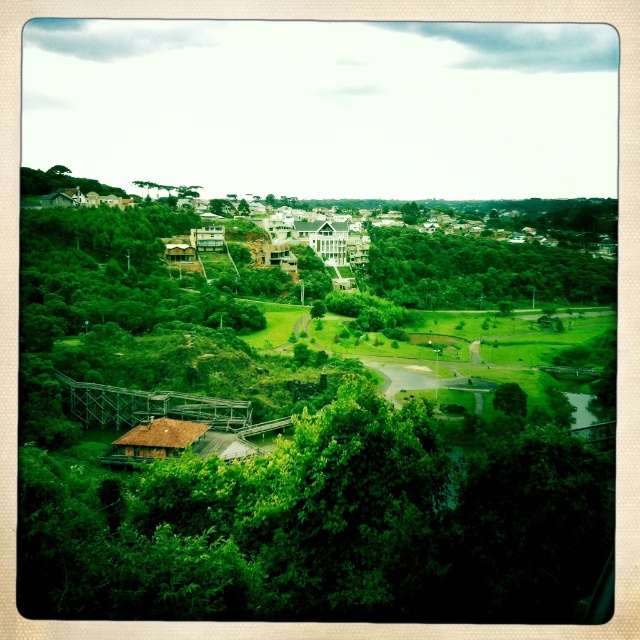
Image resolution: width=640 pixels, height=640 pixels. I want to click on green leafy tree at center, so click(x=269, y=461).

Which of these two, green leafy tree at center or green grassy field at center, stands taller?

green leafy tree at center

Is point (54, 422) farther from viewer compared to point (342, 340)?

No, (54, 422) is closer to viewer.

Where is `green leafy tree at center`? green leafy tree at center is located at coordinates (269, 461).

Which is behind, point (420, 305) or point (26, 168)?

Positioned behind is point (26, 168).

Who is positioned more to the left, green leafy trees at center-right or green leafy tree at upper left?

green leafy tree at upper left

Is point (589, 298) positioned before point (24, 182)?

No, (589, 298) is further to viewer.

What are the coordinates of `green leafy trees at center-right` in the screenshot? It's located at (481, 272).

Does green leafy tree at center have a smaller size compared to green leafy tree at upper left?

No.

You are a GUI agent. You are given a task and a screenshot of the screen. Output one action in this format:
    pyautogui.click(x=<x>, y=<y>)
    Task: Click on the green leafy tree at center
    The height and width of the screenshot is (640, 640).
    Given the screenshot: What is the action you would take?
    pyautogui.click(x=269, y=461)

Image resolution: width=640 pixels, height=640 pixels. Find the location of `green leafy tree at center`. green leafy tree at center is located at coordinates (269, 461).